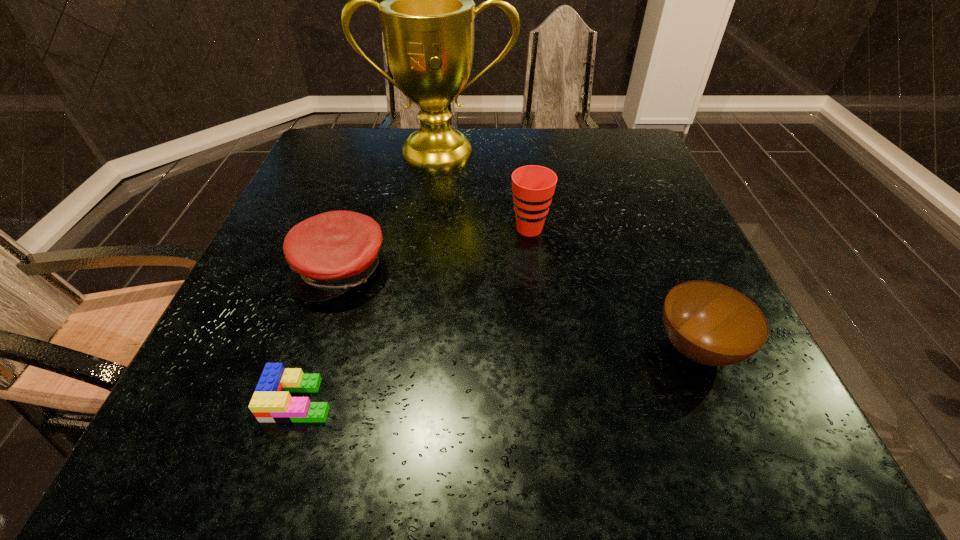
Identify the location of free space between the shortest object and the bowl. This screenshot has height=540, width=960. (498, 374).

Image resolution: width=960 pixels, height=540 pixels. In order to click on vacant point located between the tallest object and the cap in this screenshot , I will do pyautogui.click(x=391, y=210).

At what (x,y) coordinates should I click in order to perform the action: click on empty location between the fourth shortest object and the farthest object. Please return your answer as a coordinate pair (x, y). The width and height of the screenshot is (960, 540). Looking at the image, I should click on (485, 190).

Locate an element on the screen. The height and width of the screenshot is (540, 960). the closest object to the farthest object is located at coordinates [533, 186].

Where is `object that ranks as the closest to the cap`? The height and width of the screenshot is (540, 960). object that ranks as the closest to the cap is located at coordinates (271, 402).

Locate an element on the screen. This screenshot has height=540, width=960. vacant space that satisfies the following two spatial constraints: 1. on the shiny surface of the tallest object; 2. on the right side of the bowl is located at coordinates (415, 348).

This screenshot has height=540, width=960. In order to click on free spot that satisfies the following two spatial constraints: 1. on the shiny surface of the award; 2. on the left side of the cup in this screenshot , I will do `click(430, 228)`.

At what (x,y) coordinates should I click in order to perform the action: click on vacant position in the image that satisfies the following two spatial constraints: 1. on the back side of the shortest object; 2. on the left side of the second tallest object. Please return your answer as a coordinate pair (x, y). This screenshot has width=960, height=540. Looking at the image, I should click on pos(354,228).

You are a GUI agent. You are given a task and a screenshot of the screen. Output one action in this format:
    pyautogui.click(x=<x>, y=<y>)
    Task: Click on the free space that satisfies the following two spatial constraints: 1. on the shiny surface of the award; 2. on the left side of the rightmost object
    Image resolution: width=960 pixels, height=540 pixels.
    Given the screenshot: What is the action you would take?
    pyautogui.click(x=415, y=348)